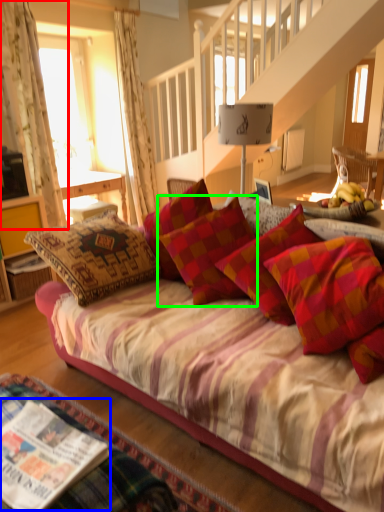
Question: Which object is the farthest from curtain (highlighted by a red box)? Choose among these: magazine (highlighted by a blue box) or pillow (highlighted by a green box).

Choices:
 (A) magazine
 (B) pillow

Answer: (A)